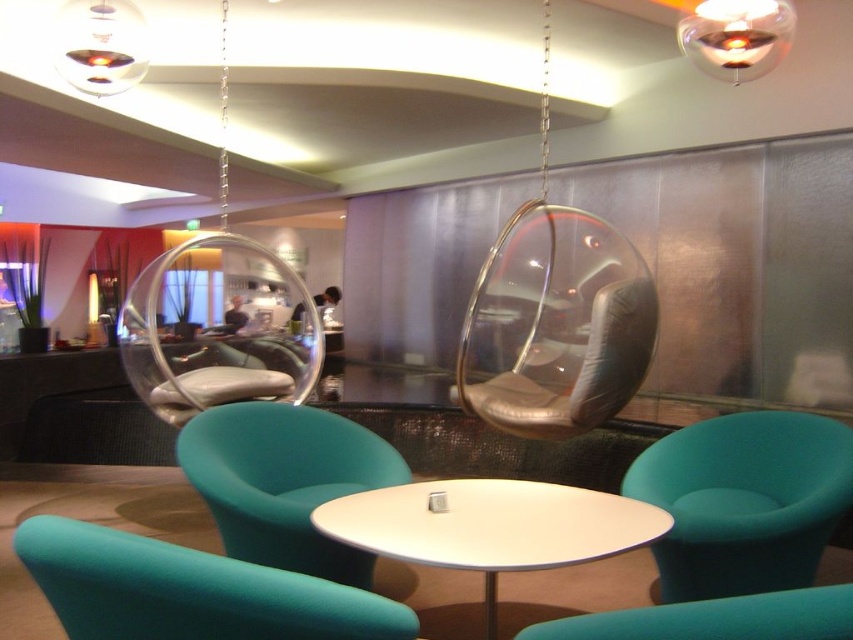
Question: Does teal fabric armchair at center have a lesser width compared to white glossy table at center?

Choices:
 (A) no
 (B) yes

Answer: (B)

Question: Which of the following is the farthest from the observer?

Choices:
 (A) (276, 529)
 (B) (16, 536)
 (C) (805, 560)

Answer: (C)

Question: Does teal fabric armchair at center appear on the left side of white glossy table at center?

Choices:
 (A) yes
 (B) no

Answer: (A)

Question: Which object is the closest to the teal fabric swivel chair at center?

Choices:
 (A) white glossy table at center
 (B) teal fabric armchair at lower right
 (C) teal fabric armchair at center

Answer: (A)

Question: Which of the following is the farthest from the observer?

Choices:
 (A) teal fabric swivel chair at center
 (B) teal fabric armchair at lower right
 (C) teal fabric chair at lower center
 (D) teal fabric armchair at center

Answer: (D)

Question: Does teal fabric armchair at center appear over white glossy table at center?

Choices:
 (A) no
 (B) yes

Answer: (B)